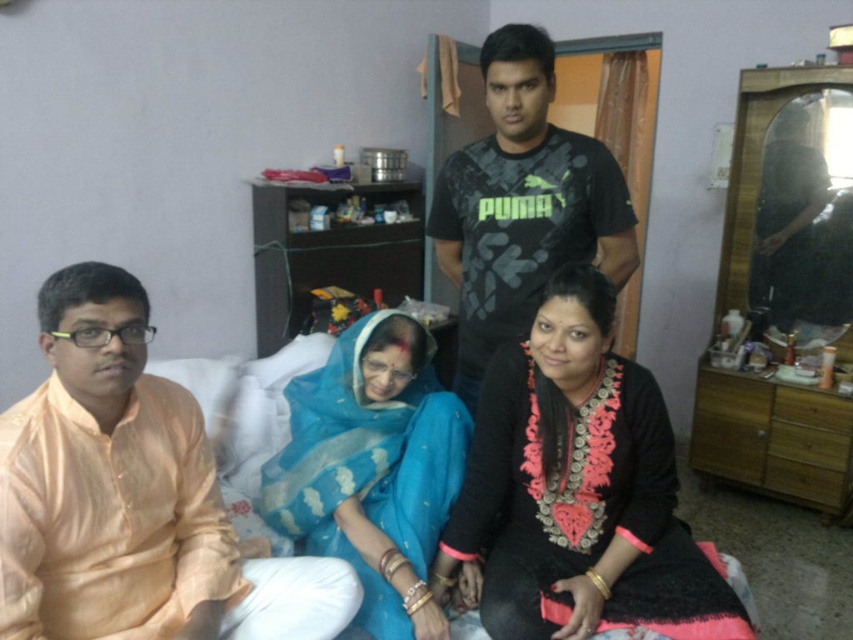
You are a photographer planning to take a group photo of the black lace dress at center and the blue silk saree at center. Since you want both to be clearly visible in the frame, which one should you focus on first to ensure the other remains in the background?

You should focus on the black lace dress at center first because it is in front of the blue silk saree at center, ensuring the latter stays in the background while the former is in focus.

You are standing in the living room and want to hand a gift to the person wearing the black lace dress at center. Which direction should you move to reach their location?

The black lace dress at center is located at point 0.767 on the x axis and 0.679 on the y axis. To reach their location, you should move towards the right and slightly forward from your current position.